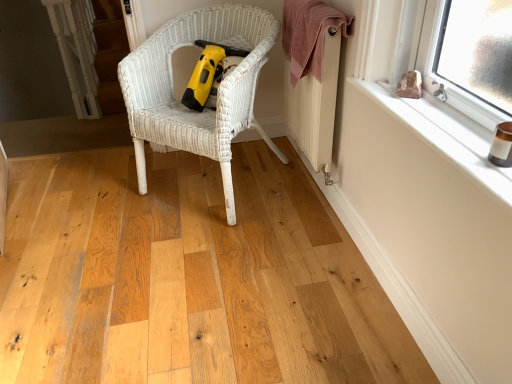
Question: From the image's perspective, is yellow plastic vacuum at center above or below white wicker chair at center?

Choices:
 (A) below
 (B) above

Answer: (B)

Question: From a real-world perspective, is yellow plastic vacuum at center positioned above or below white wicker chair at center?

Choices:
 (A) above
 (B) below

Answer: (A)

Question: Which is farther from the white wicker chair at center?

Choices:
 (A) yellow plastic vacuum at center
 (B) white painted wood at upper right
 (C) white textured radiator at upper right
 (D) pink towel at upper right

Answer: (B)

Question: Based on their relative distances, which object is nearer to the pink towel at upper right?

Choices:
 (A) yellow plastic vacuum at center
 (B) white wicker chair at center
 (C) white painted wood at upper right
 (D) white textured radiator at upper right

Answer: (D)